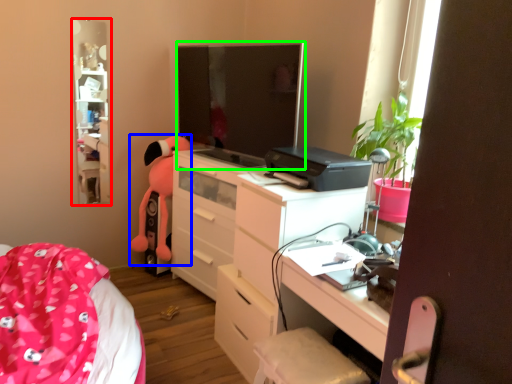
Question: Which object is the farthest from tv cabinet (highlighted by a red box)? Choose among these: toy (highlighted by a blue box) or computer monitor (highlighted by a green box).

Choices:
 (A) toy
 (B) computer monitor

Answer: (B)